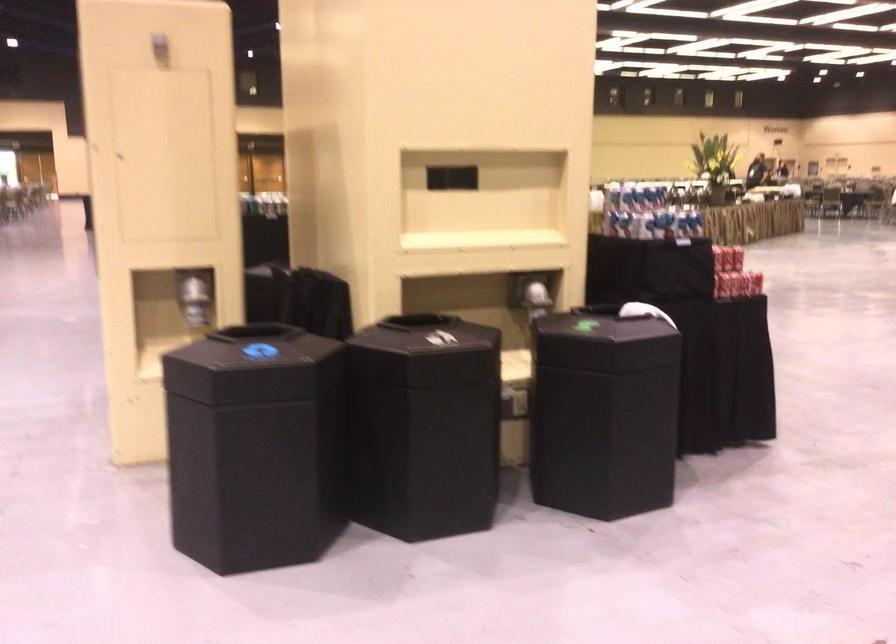
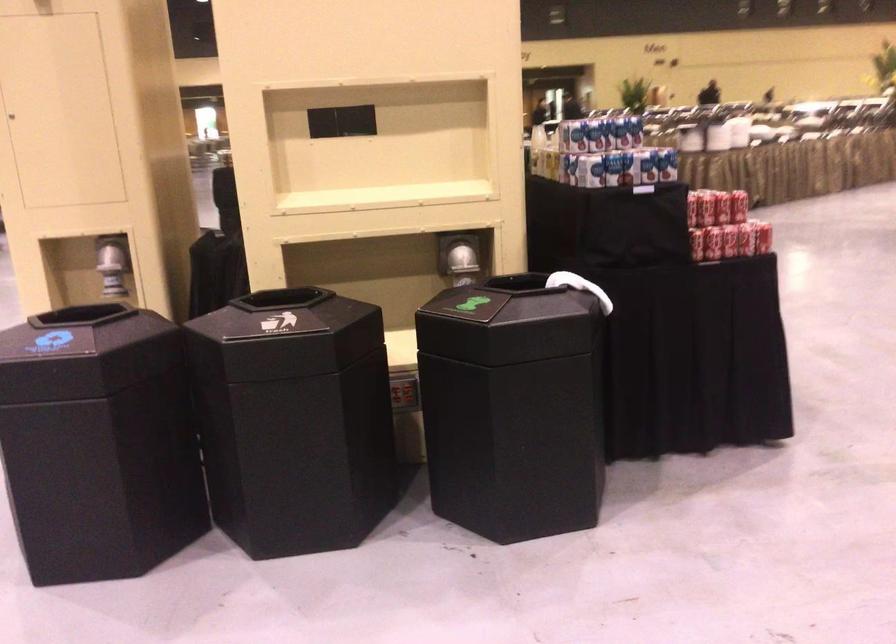
In a continuous first-person perspective shot, in which direction is the camera moving?

The movement direction of the cameraman is right, forward.